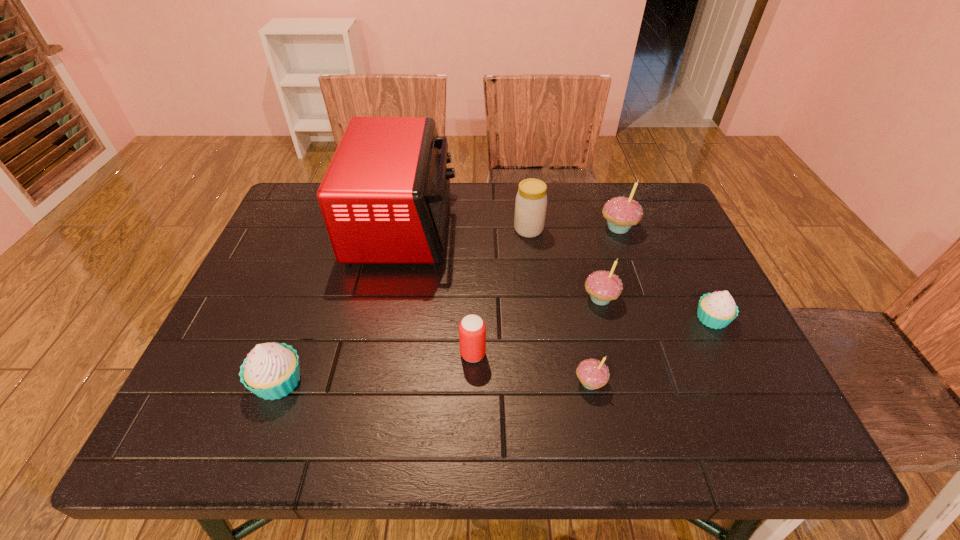
Image resolution: width=960 pixels, height=540 pixels. I want to click on free area in between the leftmost cupcake and the fourth object from left to right, so click(403, 306).

Find the location of a particular element. This screenshot has width=960, height=540. vacant space that's between the second biggest pink cupcake and the tallest object is located at coordinates (502, 262).

Identify the location of free area in between the nearest pink cupcake and the jar. (560, 306).

At what (x,y) coordinates should I click in order to perform the action: click on vacant space in between the fifth object from right to left and the biggest pink cupcake. Please return your answer as a coordinate pair (x, y). The height and width of the screenshot is (540, 960). Looking at the image, I should click on (573, 228).

Locate an element on the screen. The height and width of the screenshot is (540, 960). the second closest object to the nearest pink cupcake is located at coordinates (472, 329).

I want to click on object identified as the fifth closest to the fifth object from right to left, so click(x=716, y=310).

Locate an element on the screen. The height and width of the screenshot is (540, 960). cupcake that is the third closest to the tallest cupcake is located at coordinates (593, 374).

Choose which cupcake is the nearest neighbor to the farther white cupcake. Please provide its 2D coordinates. Your answer should be formatted as a tuple, i.e. [(x, y)], where the tuple contains the x and y coordinates of a point satisfying the conditions above.

[(603, 286)]

This screenshot has width=960, height=540. What are the coordinates of `pink cupcake that is the second nearest to the rightmost cupcake` in the screenshot? It's located at (621, 213).

This screenshot has height=540, width=960. Find the location of `pink cupcake that is the second closest to the fifth object from right to left`. pink cupcake that is the second closest to the fifth object from right to left is located at coordinates (603, 286).